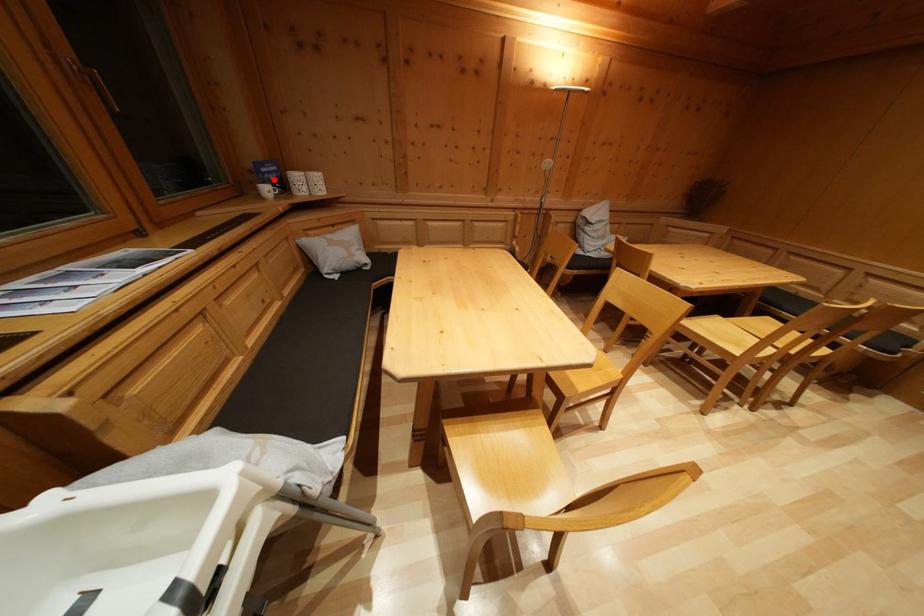
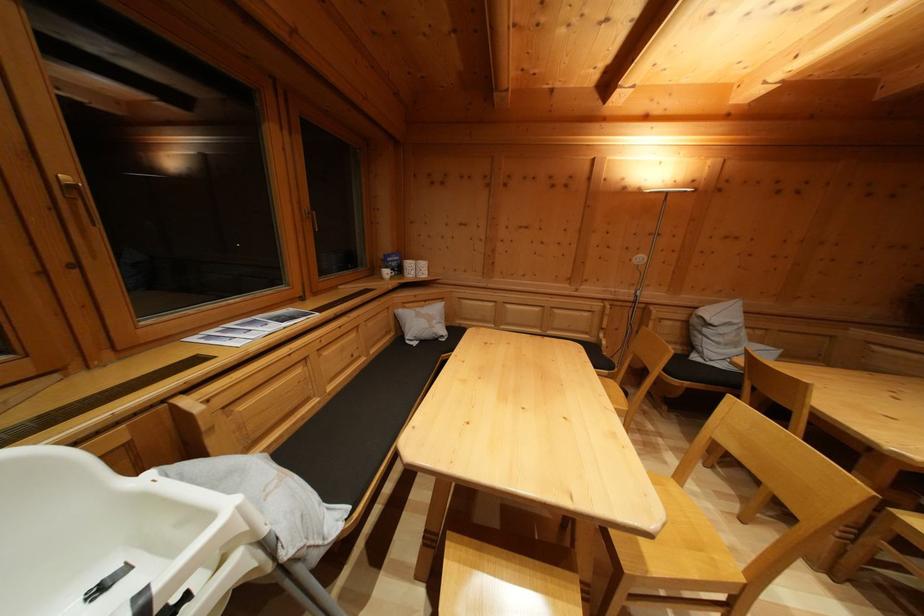
Locate, in the second image, the point that corresponds to the highlighted location in the first image.

(397, 268)